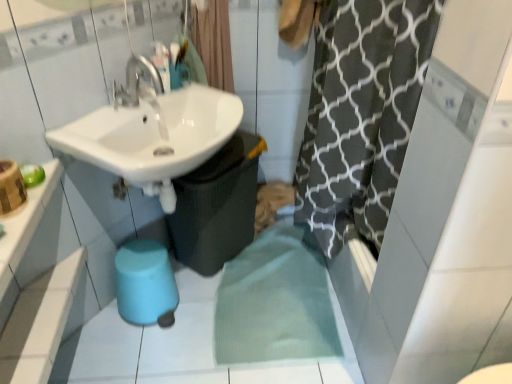
Identify the location of empty space that is ontop of blue rubber bidet at lower center (from a real-world perspective). (142, 254).